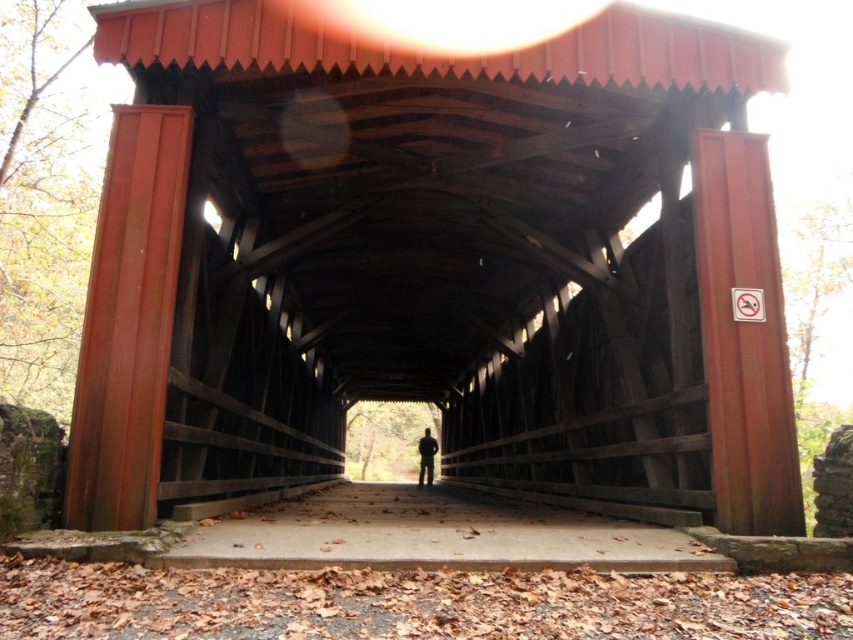
Question: Among these objects, which one is farthest from the camera?

Choices:
 (A) matte wood bridge at center
 (B) silhouette fabric at center

Answer: (B)

Question: Can you confirm if matte wood bridge at center is positioned to the left of silhouette fabric at center?

Choices:
 (A) no
 (B) yes

Answer: (B)

Question: Which object appears closest to the camera in this image?

Choices:
 (A) matte wood bridge at center
 (B) silhouette fabric at center

Answer: (A)

Question: Which of the following is the closest to the observer?

Choices:
 (A) (427, 442)
 (B) (728, 336)

Answer: (B)

Question: Can you confirm if matte wood bridge at center is bigger than silhouette fabric at center?

Choices:
 (A) no
 (B) yes

Answer: (B)

Question: Is matte wood bridge at center further to camera compared to silhouette fabric at center?

Choices:
 (A) no
 (B) yes

Answer: (A)